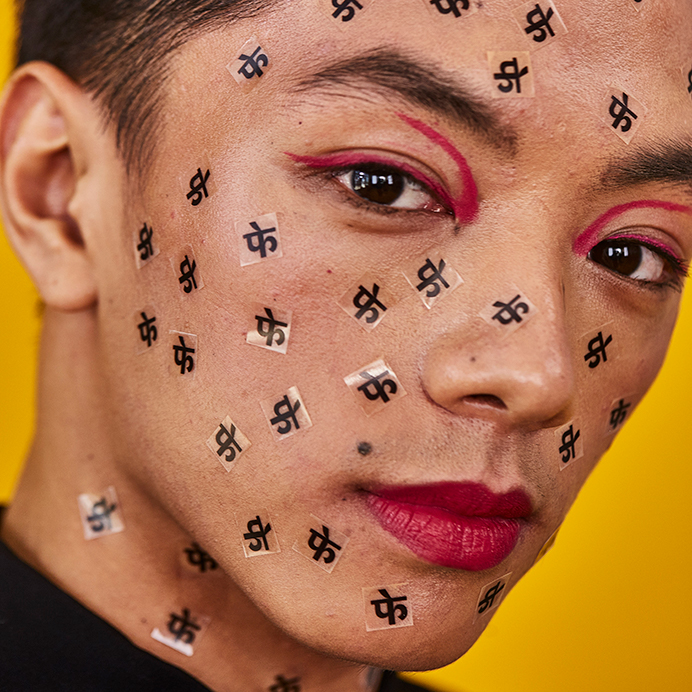
Locate an element on the screen. sticker is located at coordinates (570, 437).